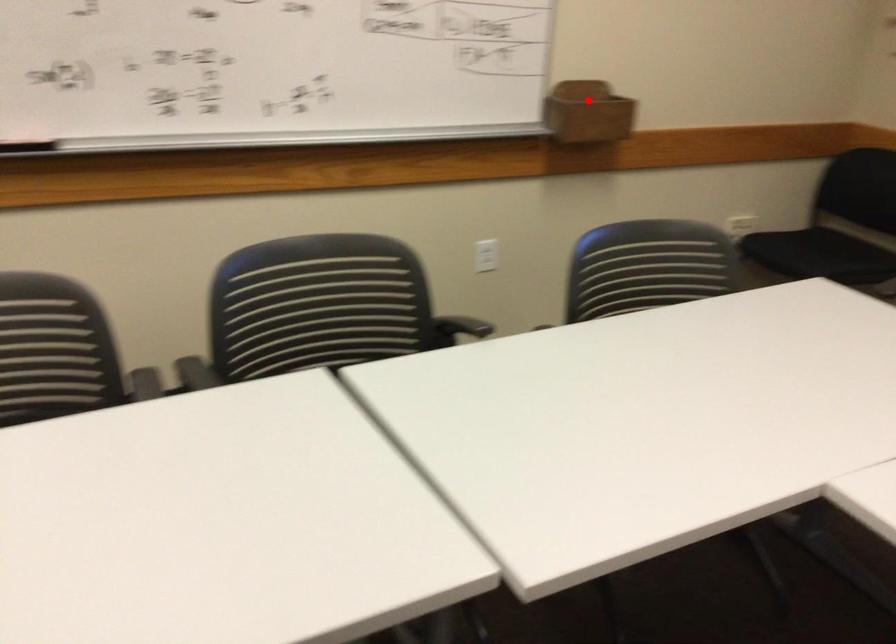
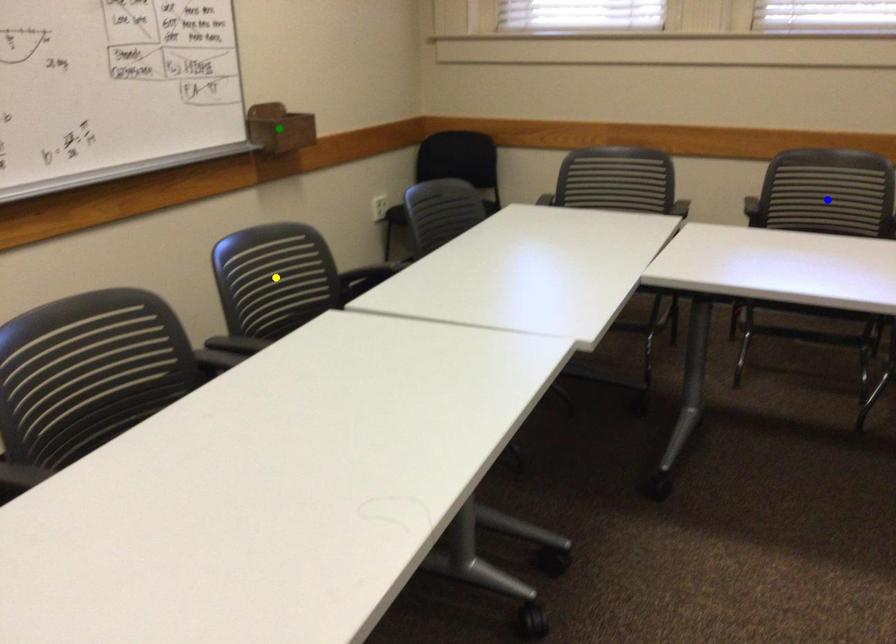
Question: I am providing you with two images of the same scene from different viewpoints. A red point is marked on the first image. You are given multiple points on the second image. Which point in image 2 is actually the same real-world point as the red point in image 1?

Choices:
 (A) green point
 (B) yellow point
 (C) blue point

Answer: (A)